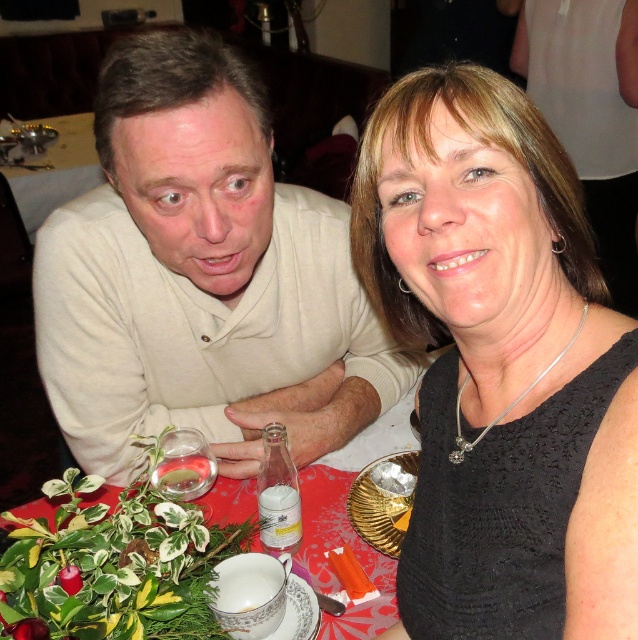
At what (x,y) coordinates should I click in order to perform the action: click on black lace dress at center. Please return your answer as a coordinate pair (x, y). This screenshot has height=640, width=638. Looking at the image, I should click on (500, 364).

You are a GUI agent. You are given a task and a screenshot of the screen. Output one action in this format:
    pyautogui.click(x=<x>, y=<y>)
    Task: Click on the black lace dress at center
    This screenshot has width=638, height=640.
    Given the screenshot: What is the action you would take?
    pyautogui.click(x=500, y=364)

Who is positioned more to the right, black lace dress at center or clear glass water at left?

From the viewer's perspective, black lace dress at center appears more on the right side.

Does point (553, 588) come in front of point (52, 182)?

Yes, point (553, 588) is in front of point (52, 182).

Where is `black lace dress at center`? Image resolution: width=638 pixels, height=640 pixels. black lace dress at center is located at coordinates (500, 364).

Does white matte shirt at left have a greater height compared to clear glass water at left?

No.

Does point (165, 369) come in front of point (91, 156)?

Yes, point (165, 369) is in front of point (91, 156).

Find the location of a particular element. white matte shirt at left is located at coordinates (202, 276).